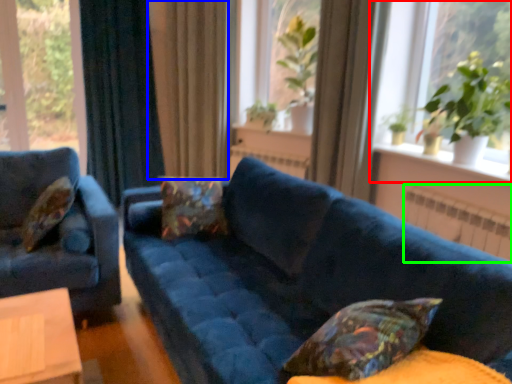
Question: Based on their relative distances, which object is farther from window (highlighted by a red box)? Choose from curtain (highlighted by a blue box) and radiator (highlighted by a green box).

Choices:
 (A) curtain
 (B) radiator

Answer: (A)